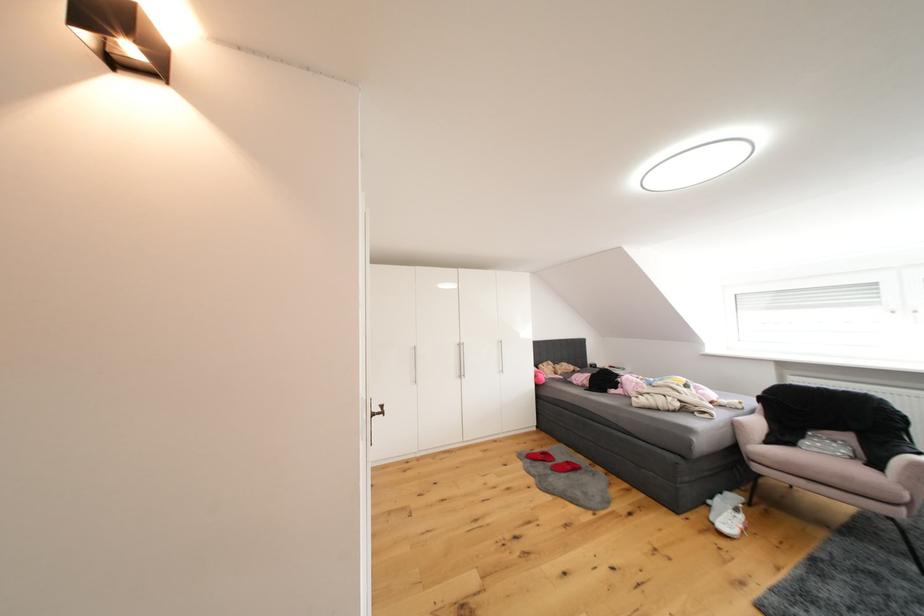
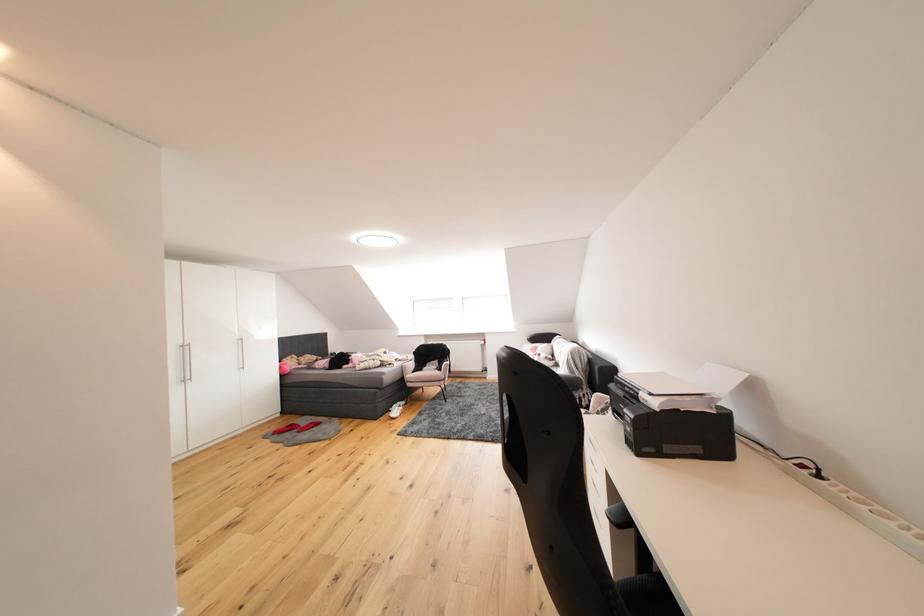
In the second image, find the point that corresponds to (x=768, y=453) in the first image.

(419, 379)